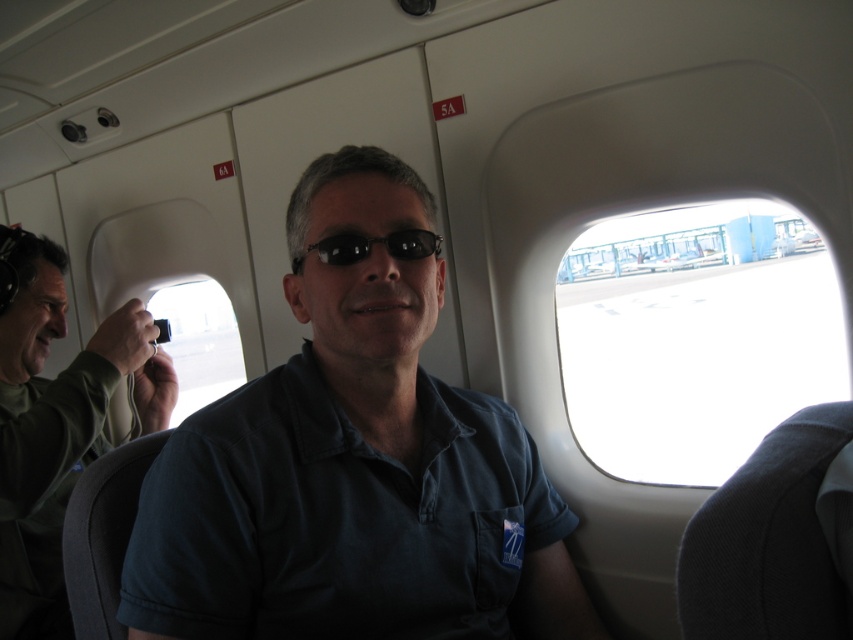
You are sitting in an airplane seat and want to look out the transparent glass airplane window at upper right without moving your head. Can you see the green matte shirt at center in your line of sight?

The transparent glass airplane window at upper right is above the green matte shirt at center, so if you look up towards the window, your line of sight would pass over the green matte shirt at center. However, since the window is transparent and the shirt is below it, you might still see the shirt in your peripheral vision or if the window reflects light, but directly looking at the window would not show the shirt itself.

You are a flight attendant checking seat spacing. The airline requires at least 30 inches between passengers for safety. Are the dark blue shirt at center and the green matte shirt at center meeting this requirement?

The dark blue shirt at center is 29.25 inches away from the green matte shirt at center, which is less than the required 30 inches. Therefore, they are not meeting the safety requirement.

You are a passenger sitting in seat 5A on the airplane. You notice two points marked in the cabin. The first point is at coordinates point (189, 385) and the second is at point (315, 243). Which point is closer to your seat?

Point (315, 243) is closer to your seat because it is closer to the camera, meaning it is nearer to the passenger in seat 5A.